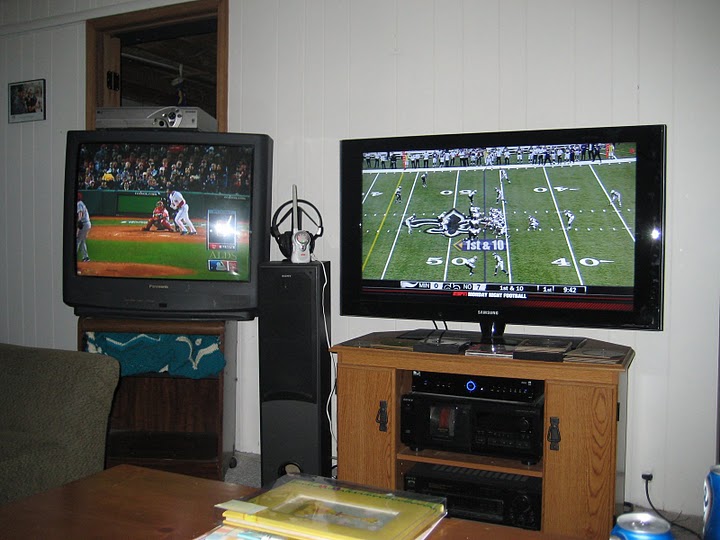
Image resolution: width=720 pixels, height=540 pixels. What are the coordinates of `coffee table` in the screenshot? It's located at (165, 516).